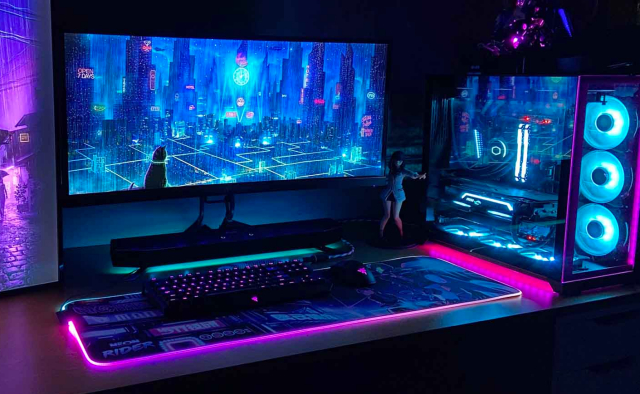
Where is `empty space under the desk`? This screenshot has width=640, height=394. empty space under the desk is located at coordinates (428, 372).